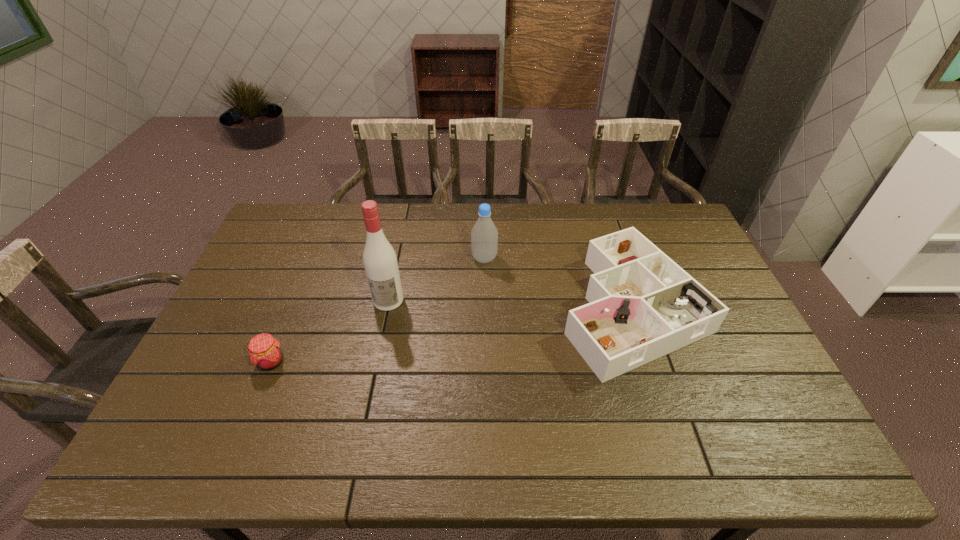
Locate an element on the screen. the third object from right to left is located at coordinates (380, 261).

In order to click on alcohol in this screenshot , I will do `click(380, 261)`.

You are a GUI agent. You are given a task and a screenshot of the screen. Output one action in this format:
    pyautogui.click(x=<x>, y=<y>)
    Task: Click on the third object from left to right
    
    Given the screenshot: What is the action you would take?
    pyautogui.click(x=484, y=235)

Identify the location of bottle. This screenshot has width=960, height=540. (484, 235).

Locate an element on the screen. dollhouse is located at coordinates (642, 305).

This screenshot has width=960, height=540. I want to click on jam, so click(x=265, y=352).

Identify the location of vacant space located 0.060m on the label of the tallest object. Image resolution: width=960 pixels, height=540 pixels. (383, 327).

This screenshot has height=540, width=960. I want to click on free point located on the back of the second object from right to left, so click(x=484, y=214).

Locate an element on the screen. This screenshot has height=540, width=960. vacant space located on the front of the rightmost object is located at coordinates (671, 423).

I want to click on vacant space located 0.170m on the right of the leftmost object, so click(x=349, y=362).